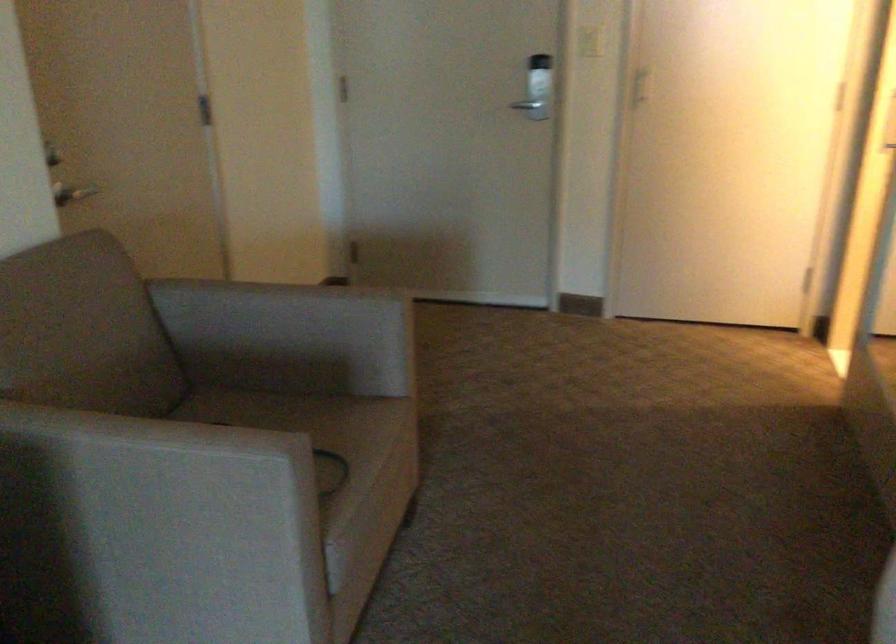
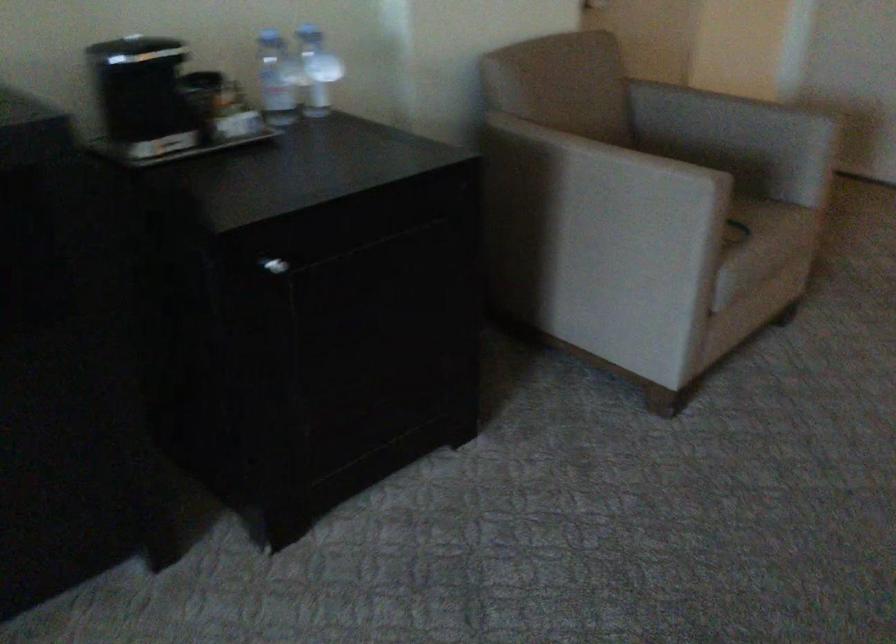
Question: The camera is either moving clockwise (left) or counter-clockwise (right) around the object. The first image is from the beginning of the video and the second image is from the end. Is the camera moving left or right when shooting the video?

Choices:
 (A) Left
 (B) Right

Answer: (B)